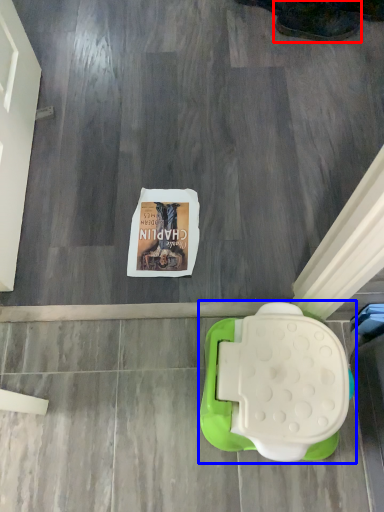
Question: Which object is further to the camera taking this photo, footwear (highlighted by a red box) or toilet (highlighted by a blue box)?

Choices:
 (A) footwear
 (B) toilet

Answer: (A)